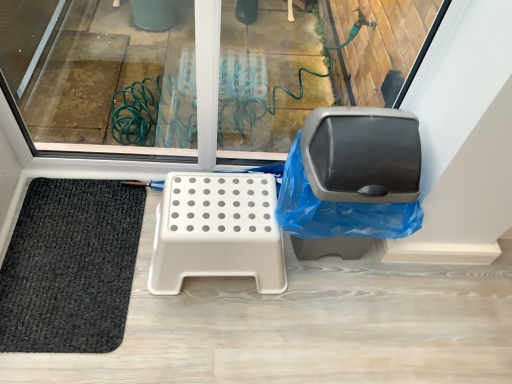
Find the location of `unoccupied region to the right of matte gray swivel chair at right`. unoccupied region to the right of matte gray swivel chair at right is located at coordinates (416, 294).